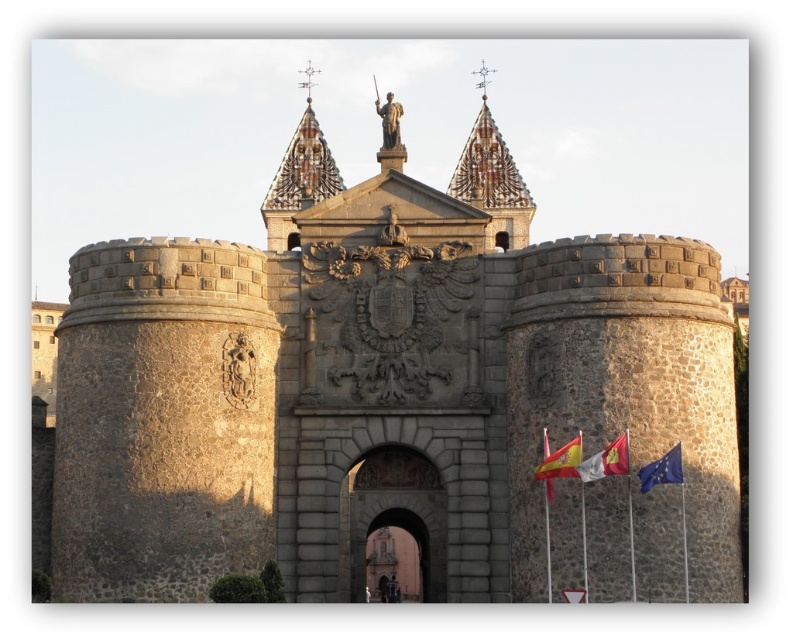
You are a tourist standing in front of the historic stone structure and notice two flags at the lower right corner. Which flag is positioned higher between the white fabric flag at lower right and the blue fabric flag at lower right?

The white fabric flag at lower right is positioned higher than the blue fabric flag at lower right as it is above the blue fabric flag at lower right.

You are a visitor approaching the historic stone structure and notice two flags. Which flag, the blue fabric flag at lower right or the red fabric flag at center, is positioned higher up relative to the other?

The blue fabric flag at lower right is positioned above the red fabric flag at center.